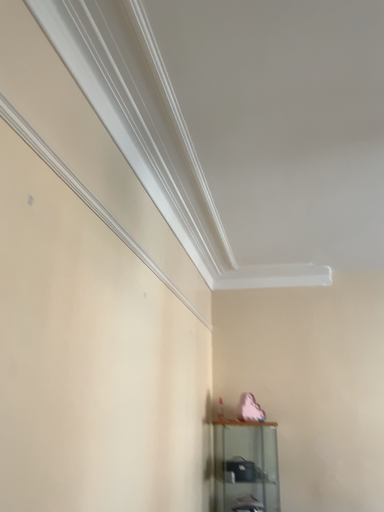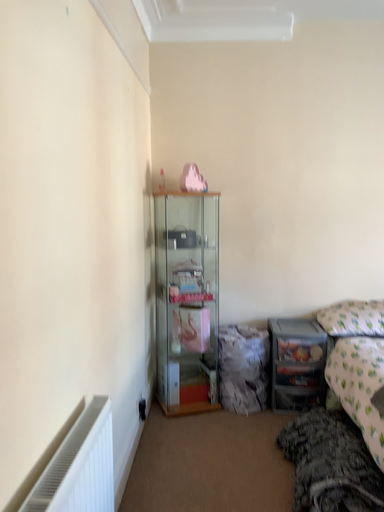
Question: Which way did the camera rotate in the video?

Choices:
 (A) rotated left
 (B) rotated right

Answer: (B)